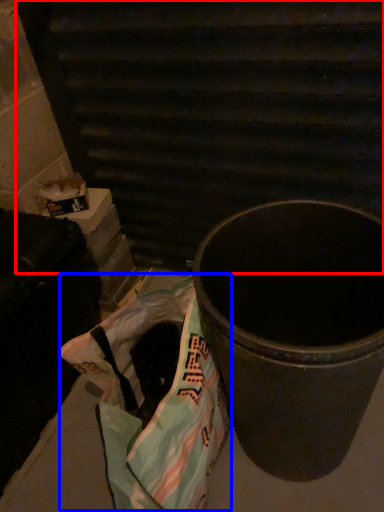
Question: Which object appears farthest to the camera in this image, stairwell (highlighted by a red box) or grocery bag (highlighted by a blue box)?

Choices:
 (A) stairwell
 (B) grocery bag

Answer: (A)